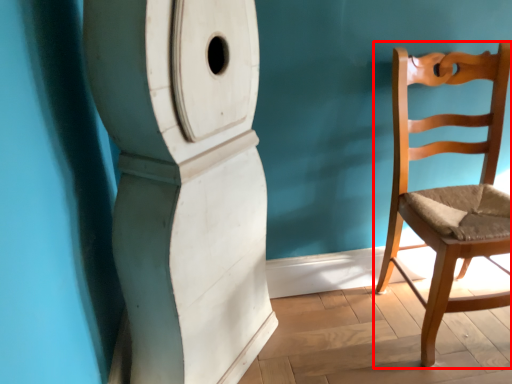
Question: From the image's perspective, what is the correct spatial relationship of chair (annotated by the red box) in relation to pillar?

Choices:
 (A) below
 (B) above

Answer: (B)